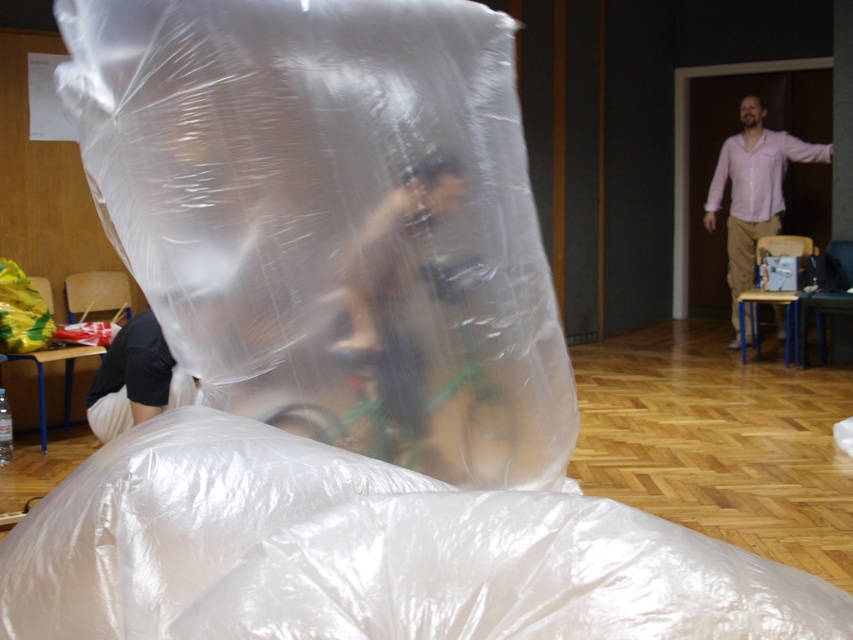
Question: Which of the following is the closest to the observer?

Choices:
 (A) brown leather jacket at center
 (B) transparent plastic bag at center

Answer: (B)

Question: Which of the following is the farthest from the observer?

Choices:
 (A) brown leather jacket at center
 (B) transparent plastic bag at center
 (C) green metallic bicycle at center
 (D) pink shirt at right

Answer: (D)

Question: Is brown leather jacket at center further to camera compared to pink shirt at right?

Choices:
 (A) no
 (B) yes

Answer: (A)

Question: Which point is closer to the camera?

Choices:
 (A) brown leather jacket at center
 (B) pink shirt at right

Answer: (A)

Question: Is transparent plastic bag at center bigger than green metallic bicycle at center?

Choices:
 (A) yes
 (B) no

Answer: (A)

Question: Does green metallic bicycle at center lie behind pink shirt at right?

Choices:
 (A) no
 (B) yes

Answer: (A)